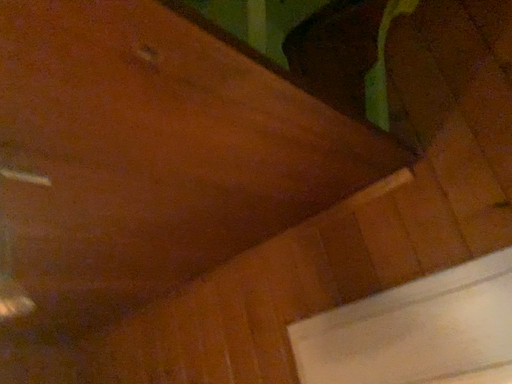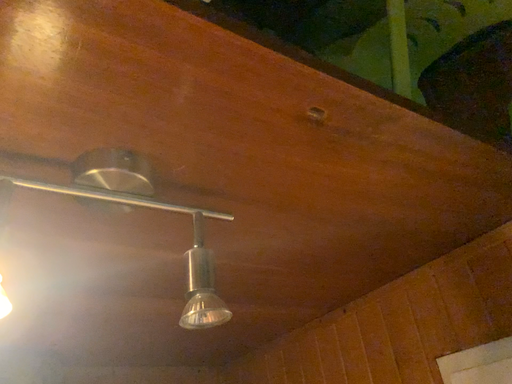
Question: How did the camera likely rotate when shooting the video?

Choices:
 (A) rotated right
 (B) rotated left

Answer: (B)